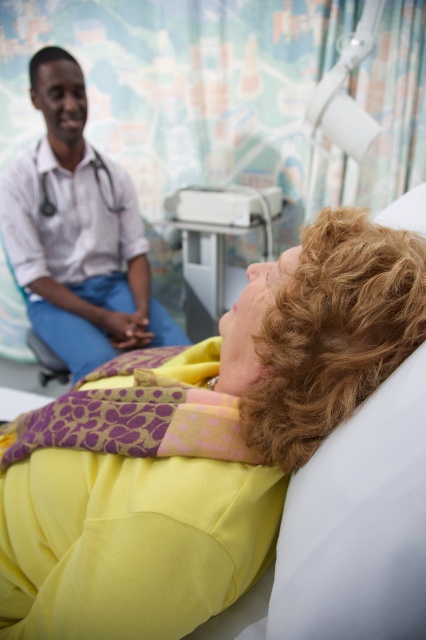
Question: Is yellow fabric at center further to the viewer compared to matte white shirt at left?

Choices:
 (A) no
 (B) yes

Answer: (A)

Question: Which point is closer to the camera?

Choices:
 (A) matte white shirt at left
 (B) white plastic tray at center

Answer: (A)

Question: Among these objects, which one is nearest to the camera?

Choices:
 (A) yellow fabric at center
 (B) white plastic tray at center
 (C) matte white shirt at left

Answer: (A)

Question: Is yellow fabric at center closer to camera compared to matte white shirt at left?

Choices:
 (A) yes
 (B) no

Answer: (A)

Question: Estimate the real-world distances between objects in this image. Which object is farther from the yellow fabric at center?

Choices:
 (A) matte white shirt at left
 (B) white plastic tray at center

Answer: (B)

Question: Does yellow fabric at center appear over matte white shirt at left?

Choices:
 (A) no
 (B) yes

Answer: (A)